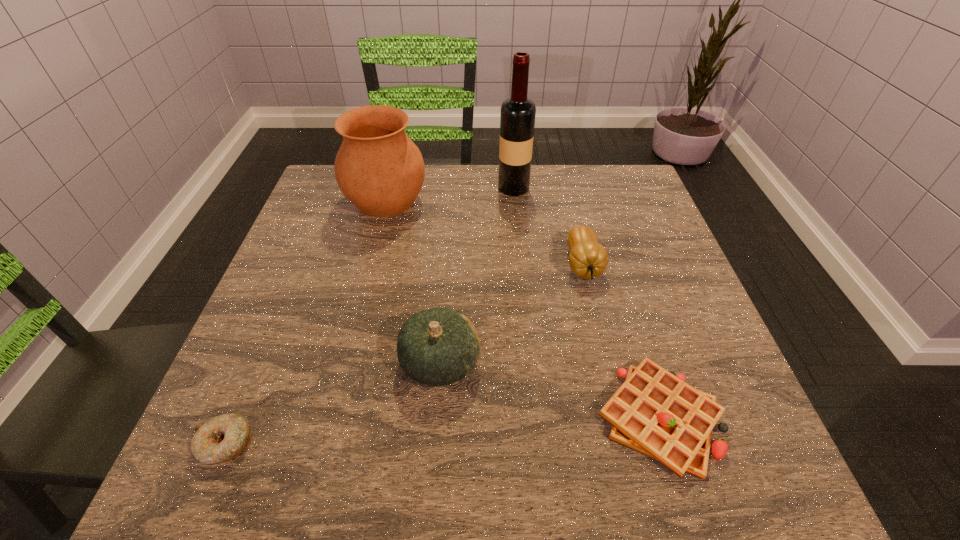
Identify the location of the closest object to the shorter gourd. Image resolution: width=960 pixels, height=540 pixels. (654, 412).

Choose which object is the second nearest neighbor to the fourth shortest object. Please provide its 2D coordinates. Your answer should be formatted as a tuple, i.e. [(x, y)], where the tuple contains the x and y coordinates of a point satisfying the conditions above.

[(588, 259)]

This screenshot has width=960, height=540. In order to click on free location that satisfies the following two spatial constraints: 1. on the stem side of the waffle; 2. on the left side of the fourth nearest object in this screenshot , I will do click(x=619, y=418).

Identify the location of free spot that satisfies the following two spatial constraints: 1. on the back side of the tallest object; 2. on the right side of the second tallest object. The width and height of the screenshot is (960, 540). (390, 187).

The image size is (960, 540). What are the coordinates of `vacant space that satisfies the following two spatial constraints: 1. on the back side of the second shortest object; 2. on the left side of the shortest object` in the screenshot? It's located at (236, 418).

What are the coordinates of `vacant point that satisfies the following two spatial constraints: 1. on the back side of the fifth shortest object; 2. on the right side of the shortest object` in the screenshot? It's located at (327, 201).